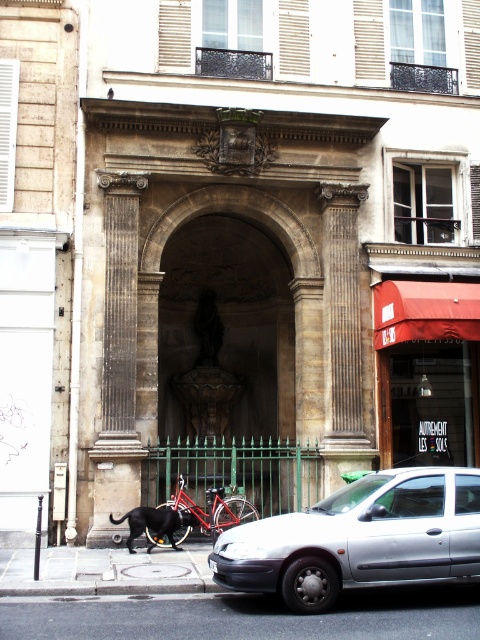
Question: Does brown stone archway at center appear under silver metallic car at lower right?

Choices:
 (A) no
 (B) yes

Answer: (A)

Question: Which of the following is the farthest from the observer?

Choices:
 (A) red fabric awning at lower right
 (B) shiny red bicycle at lower center
 (C) black fur dog at lower left
 (D) brown stone archway at center

Answer: (A)

Question: Can you confirm if brown stone archway at center is smaller than black fur dog at lower left?

Choices:
 (A) yes
 (B) no

Answer: (B)

Question: Which is farther from the silver metallic car at lower right?

Choices:
 (A) brown stone archway at center
 (B) black fur dog at lower left

Answer: (A)

Question: Estimate the real-world distances between objects in this image. Which object is farther from the red fabric awning at lower right?

Choices:
 (A) silver metallic car at lower right
 (B) brown stone archway at center
 (C) black fur dog at lower left
 (D) shiny red bicycle at lower center

Answer: (A)

Question: Considering the relative positions of silver metallic car at lower right and shiny red bicycle at lower center in the image provided, where is silver metallic car at lower right located with respect to shiny red bicycle at lower center?

Choices:
 (A) right
 (B) left

Answer: (A)